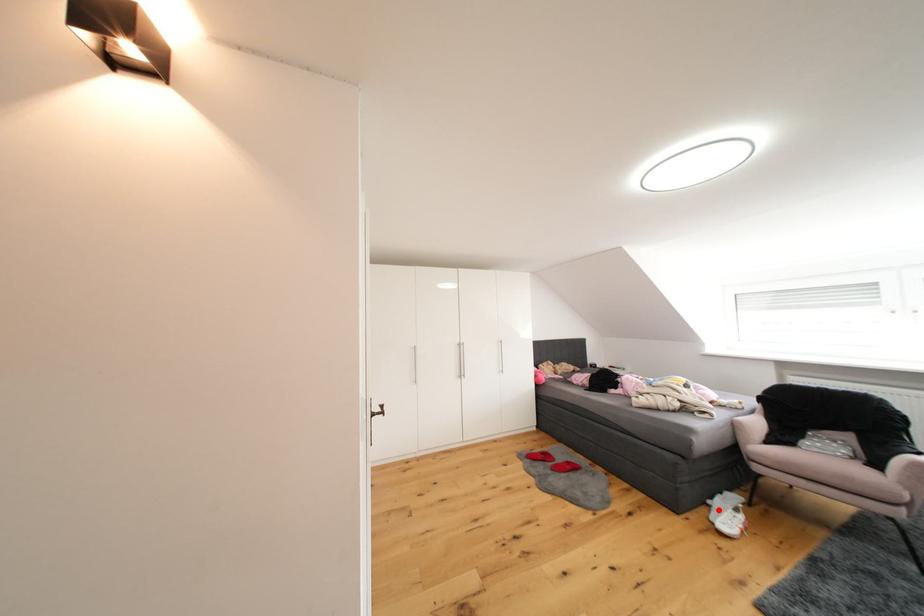
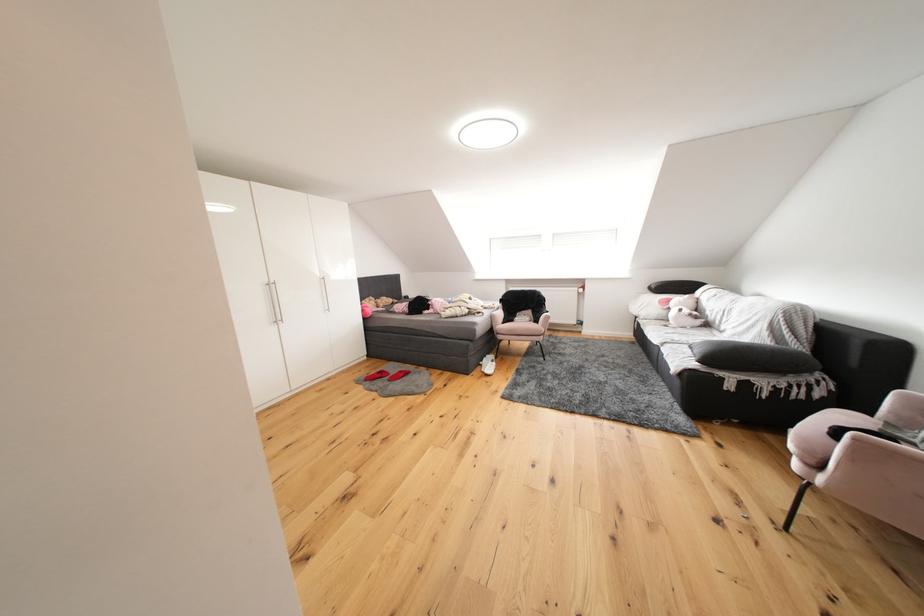
Find the pixel in the second image that matches the highlighted location in the first image.

(490, 369)